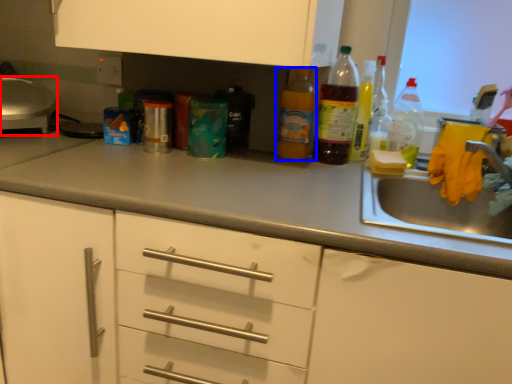
Question: Which point is further to the camera, appliance (highlighted by a red box) or bottle (highlighted by a blue box)?

Choices:
 (A) appliance
 (B) bottle

Answer: (B)